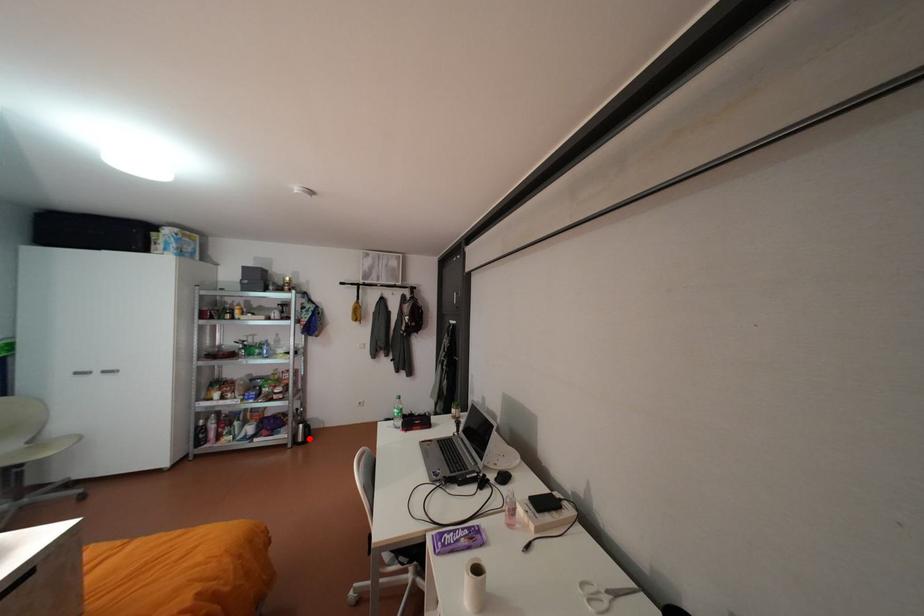
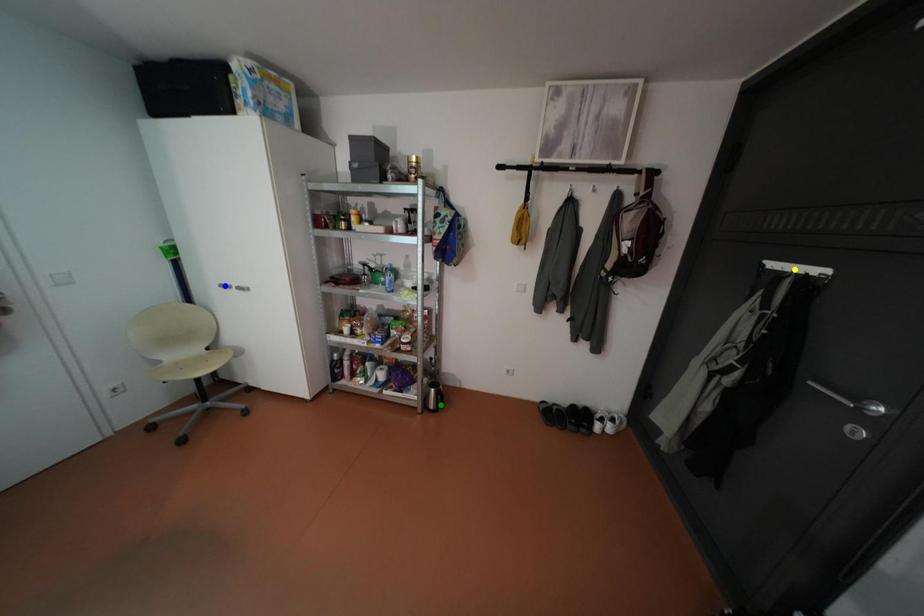
Question: I am providing you with two images of the same scene from different viewpoints. A red point is marked on the first image. You are given multiple points on the second image. Which spot in image 2 lines up with the point in image 1?

Choices:
 (A) yellow point
 (B) green point
 (C) blue point

Answer: (B)